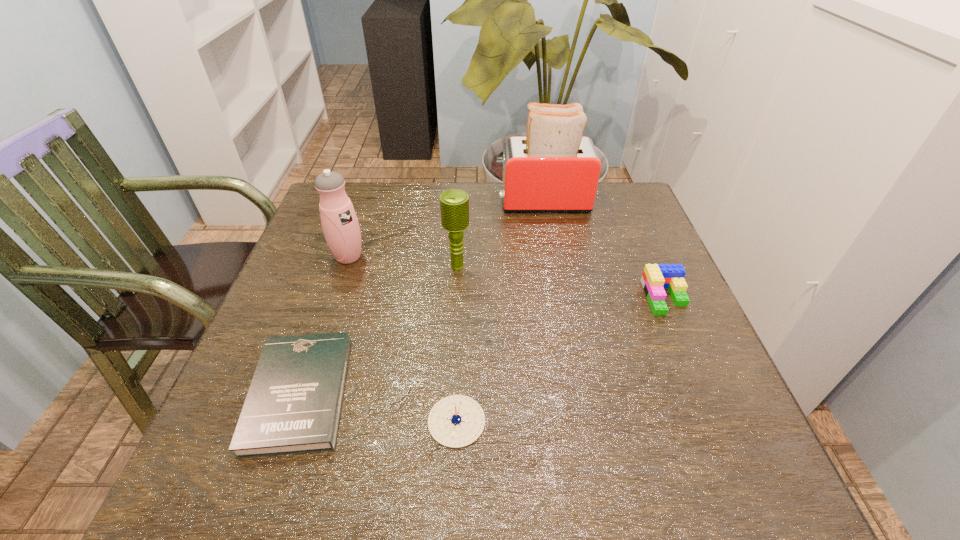
Find the location of a particular element. The width and height of the screenshot is (960, 540). book that is at the left edge is located at coordinates (293, 406).

Where is `toaster located in the right edge section of the desktop`? The height and width of the screenshot is (540, 960). toaster located in the right edge section of the desktop is located at coordinates (554, 169).

At what (x,y) coordinates should I click in order to perform the action: click on Lego that is at the right edge. Please return your answer as a coordinate pair (x, y). This screenshot has width=960, height=540. Looking at the image, I should click on (655, 277).

What are the coordinates of `object located in the near left corner section of the desktop` in the screenshot? It's located at (293, 406).

This screenshot has width=960, height=540. I want to click on object present at the far right corner, so click(554, 169).

I want to click on blank space at the far edge of the desktop, so click(399, 204).

I want to click on vacant space at the near edge of the desktop, so click(x=369, y=461).

In the image, there is a desktop. What are the coordinates of `vacant space at the left edge` in the screenshot? It's located at coord(223,416).

In the image, there is a desktop. Where is `vacant space at the right edge`? This screenshot has height=540, width=960. vacant space at the right edge is located at coordinates (623, 325).

Identify the location of vacant area at the far right corner. This screenshot has height=540, width=960. (629, 208).